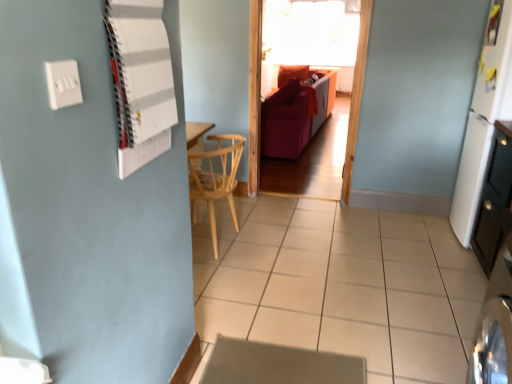
Find the location of a particular element. free space between natural wood chair at center and transparent glass door at center is located at coordinates [x=279, y=217].